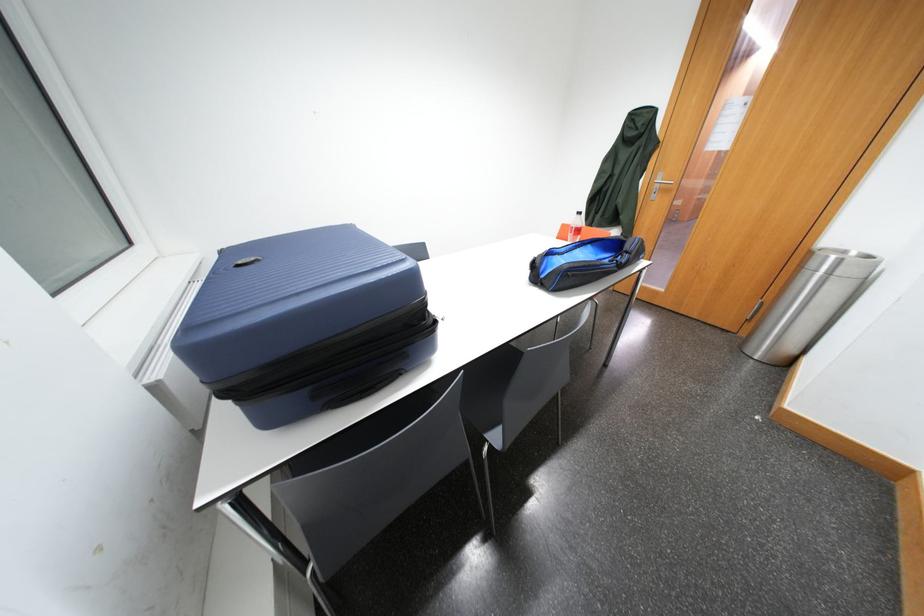
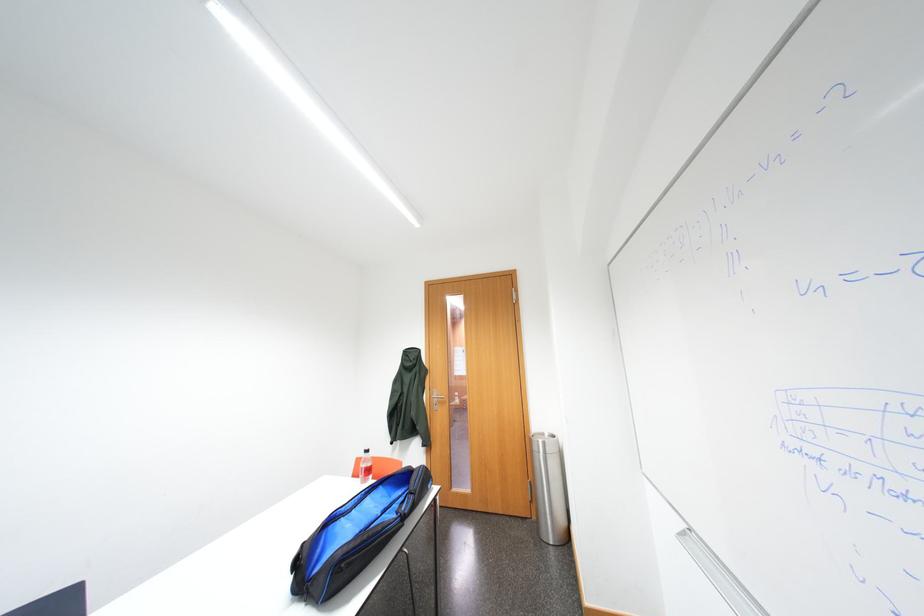
How did the camera likely rotate?

The rotation direction of the camera is right-up.